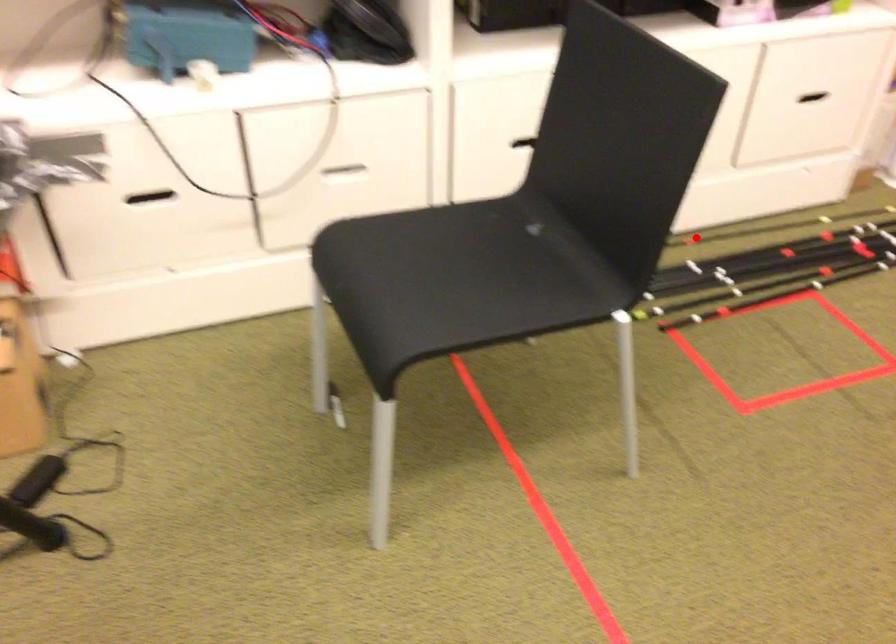
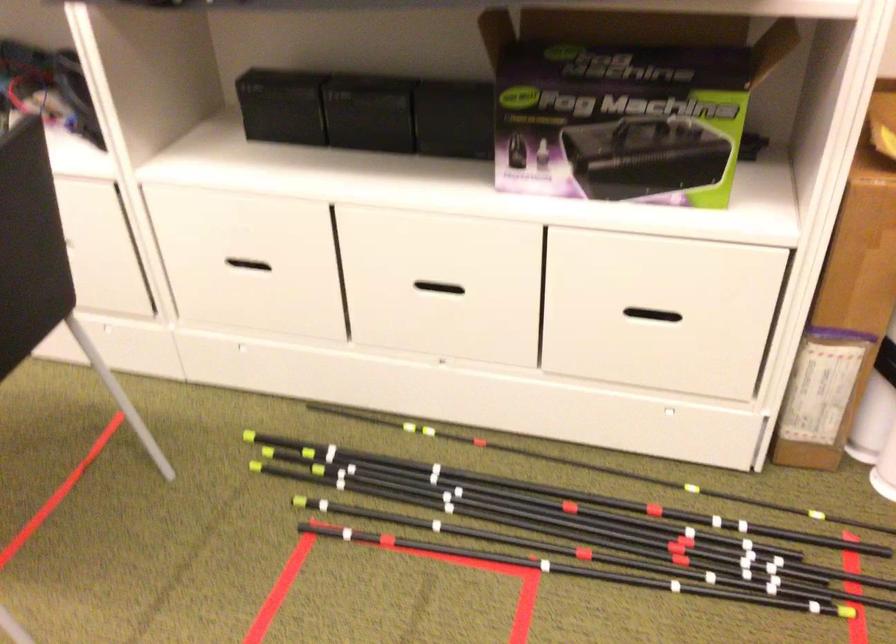
Question: I am providing you with two images of the same scene from different viewpoints. In image1, a red point is highlighted. Considering the same 3D point in image2, which of the following is correct?

Choices:
 (A) It is closer
 (B) It is farther

Answer: (A)